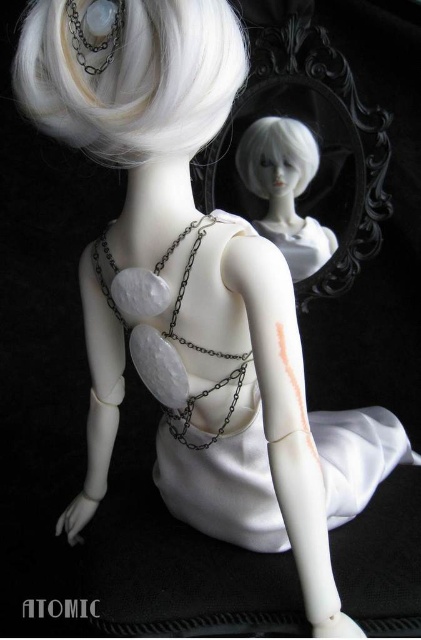
Question: Which point is farther from the camera taking this photo?

Choices:
 (A) (157, 376)
 (B) (68, 104)
 (C) (295, 122)
 (D) (250, 161)

Answer: (D)

Question: Is white matte doll head at upper center bigger than white matte wig at upper center?

Choices:
 (A) yes
 (B) no

Answer: (A)

Question: Which point appears farthest from the camera in this image?

Choices:
 (A) (330, 244)
 (B) (109, 88)
 (C) (306, 168)

Answer: (A)

Question: Which point appears closest to the camera in this image?

Choices:
 (A) [271, 205]
 (B) [95, 260]
 (C) [23, 33]

Answer: (C)

Question: Does matte silver chain at center appear over white matte wig at upper center?

Choices:
 (A) yes
 (B) no

Answer: (B)

Question: Is white matte dress at center thinner than white matte wig at upper center?

Choices:
 (A) yes
 (B) no

Answer: (B)